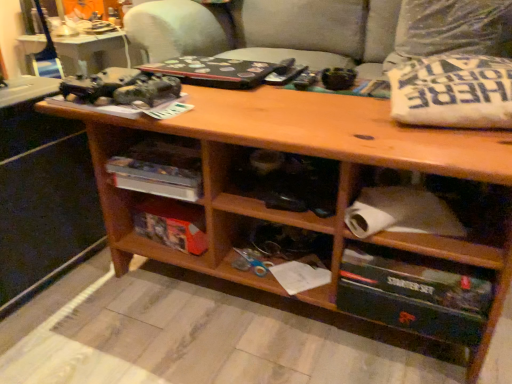
Question: Is orange cardboard box at center further to camera compared to black cardboard starter set at lower right?

Choices:
 (A) yes
 (B) no

Answer: (A)

Question: From a real-world perspective, is orange cardboard box at center under black cardboard starter set at lower right?

Choices:
 (A) yes
 (B) no

Answer: (A)

Question: Would you say black cardboard starter set at lower right is part of orange cardboard box at center's contents?

Choices:
 (A) yes
 (B) no

Answer: (B)

Question: Is orange cardboard box at center not near black cardboard starter set at lower right?

Choices:
 (A) no
 (B) yes

Answer: (A)

Question: Can you confirm if orange cardboard box at center is positioned to the left of black cardboard starter set at lower right?

Choices:
 (A) no
 (B) yes

Answer: (B)

Question: Is black cardboard starter set at lower right bigger or smaller than wooden shelf at center?

Choices:
 (A) big
 (B) small

Answer: (A)

Question: Considering the positions of black cardboard starter set at lower right and wooden shelf at center in the image, is black cardboard starter set at lower right taller or shorter than wooden shelf at center?

Choices:
 (A) short
 (B) tall

Answer: (B)

Question: From the image's perspective, relative to wooden shelf at center, is black cardboard starter set at lower right above or below?

Choices:
 (A) below
 (B) above

Answer: (A)

Question: Considering their positions, is black cardboard starter set at lower right located in front of or behind wooden shelf at center?

Choices:
 (A) behind
 (B) front

Answer: (B)

Question: Is orange cardboard box at center in front of or behind wooden shelf at center in the image?

Choices:
 (A) front
 (B) behind

Answer: (B)

Question: Which is correct: orange cardboard box at center is inside wooden shelf at center, or outside of it?

Choices:
 (A) outside
 (B) inside

Answer: (A)

Question: Considering the positions of point (141, 211) and point (142, 162), is point (141, 211) closer or farther from the camera than point (142, 162)?

Choices:
 (A) farther
 (B) closer

Answer: (A)

Question: Considering the positions of orange cardboard box at center and wooden shelf at center in the image, is orange cardboard box at center bigger or smaller than wooden shelf at center?

Choices:
 (A) small
 (B) big

Answer: (A)

Question: From the image's perspective, relative to white cotton pillow at upper right, arranged as the 2th pillow when viewed from the top, is black cardboard starter set at lower right above or below?

Choices:
 (A) below
 (B) above

Answer: (A)

Question: Is black cardboard starter set at lower right wider or thinner than white cotton pillow at upper right, which is the first pillow in bottom-to-top order?

Choices:
 (A) wide
 (B) thin

Answer: (B)